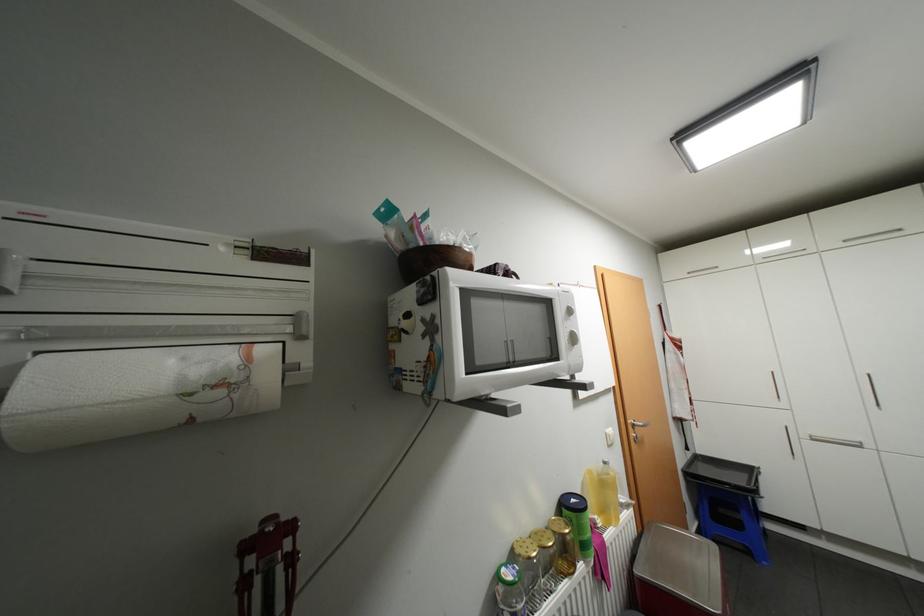
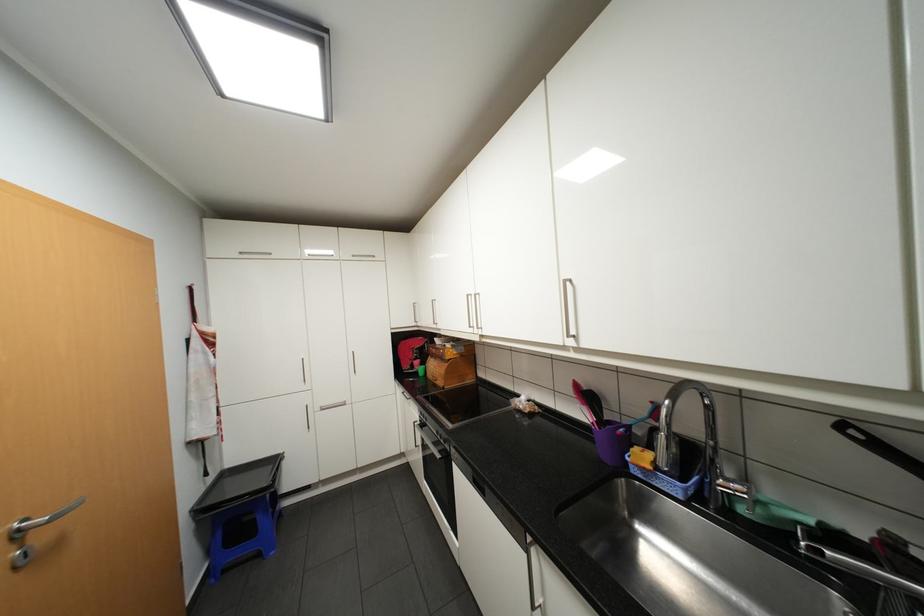
Question: How did the camera likely rotate?

Choices:
 (A) Left
 (B) Right
 (C) Up
 (D) Down

Answer: (B)